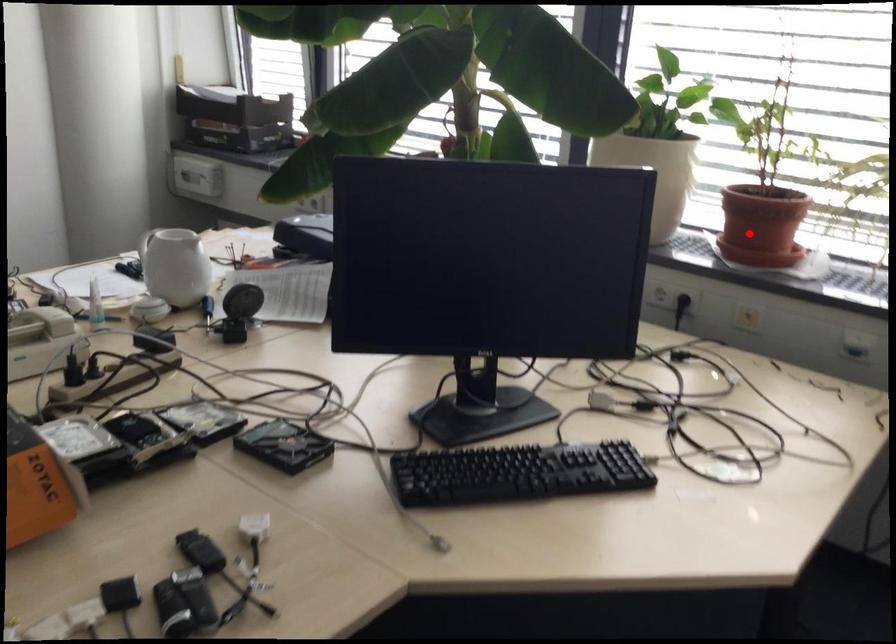
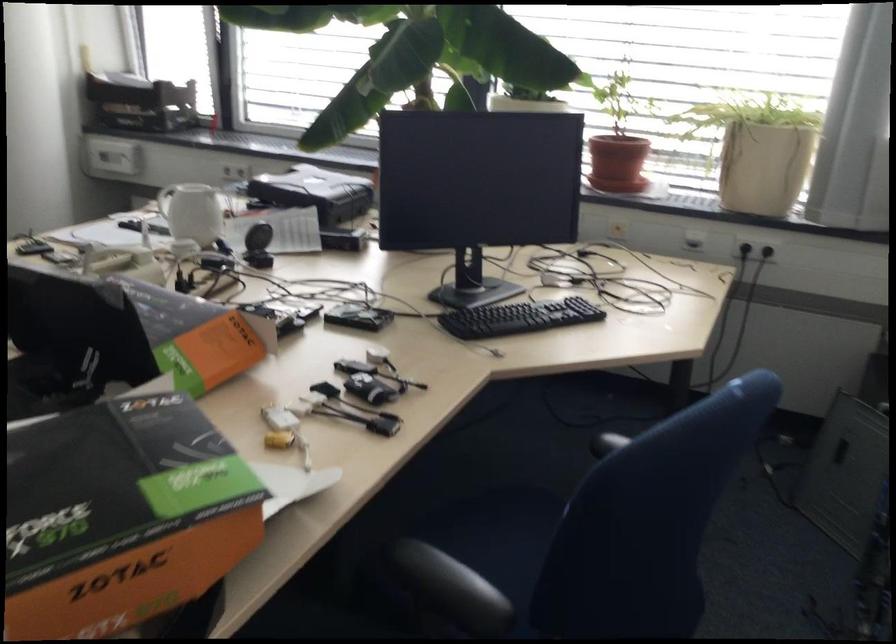
In the second image, find the point that corresponds to the highlighted location in the first image.

(616, 163)